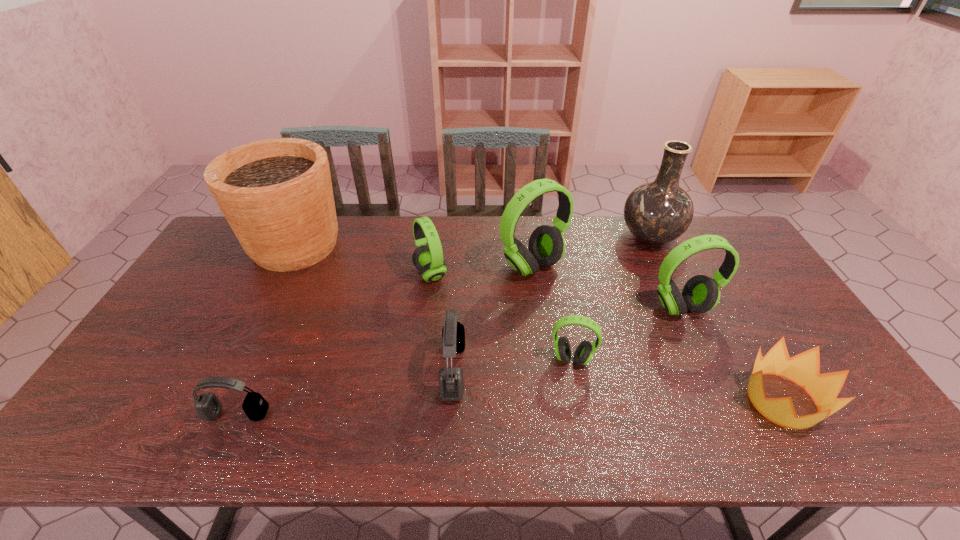
At what (x,y) coordinates should I click in order to perform the action: click on free space located 0.060m on the left of the gold crown. Please return your answer as a coordinate pair (x, y). This screenshot has height=540, width=960. Looking at the image, I should click on (717, 401).

Identify the location of vase located in the far edge section of the desktop. (657, 212).

This screenshot has width=960, height=540. What are the coordinates of `flowerpot situated at the far edge` in the screenshot? It's located at tap(276, 194).

Where is `headset that is at the far edge`? The width and height of the screenshot is (960, 540). headset that is at the far edge is located at coordinates coord(546,247).

Locate an element on the screen. headset that is at the near edge is located at coordinates (208, 407).

You are a GUI agent. You are given a task and a screenshot of the screen. Output one action in this format:
    pyautogui.click(x=<x>, y=<y>)
    Task: Click on the crown that is positioned at the near edge
    This screenshot has height=540, width=960.
    Given the screenshot: What is the action you would take?
    pyautogui.click(x=803, y=369)

You are a GUI agent. You are given a task and a screenshot of the screen. Output one action in this format:
    pyautogui.click(x=<x>, y=<y>)
    Task: Click on the object that is positioned at the left edge
    
    Given the screenshot: What is the action you would take?
    pyautogui.click(x=276, y=194)

Identify the location of object that is at the right edge. The height and width of the screenshot is (540, 960). (803, 369).

In order to click on object positioned at the far left corner in this screenshot , I will do `click(276, 194)`.

The width and height of the screenshot is (960, 540). Identify the location of object at the near right corner. (803, 369).